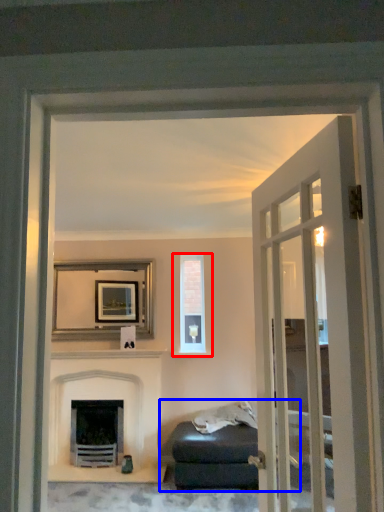
Question: Which point is closer to the camera, window (highlighted by a red box) or studio couch (highlighted by a blue box)?

Choices:
 (A) window
 (B) studio couch

Answer: (B)